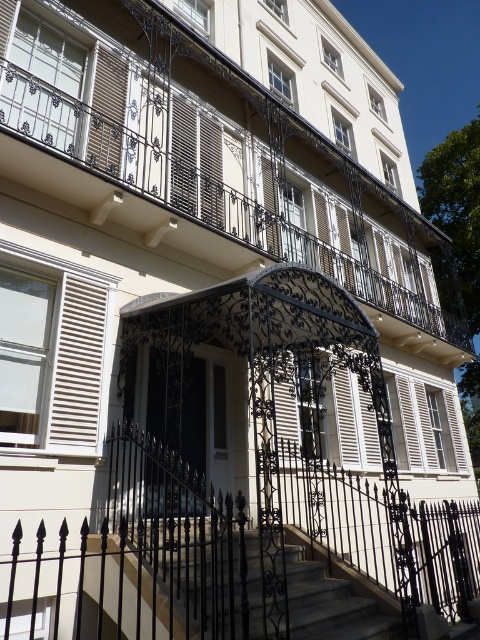
Question: Which of the following is the farthest from the observer?

Choices:
 (A) (364, 252)
 (B) (288, 545)

Answer: (A)

Question: Which is nearer to the white matte shutter at left?

Choices:
 (A) white matte shutter at upper left
 (B) smooth stone stairs at center

Answer: (A)

Question: From the image, what is the correct spatial relationship of black wrought iron balcony at center in relation to white matte shutter at left?

Choices:
 (A) above
 (B) below

Answer: (A)

Question: Which point appears closest to the camera in this image?

Choices:
 (A) coord(9,150)
 (B) coord(71,419)
 (C) coord(312,589)
 (D) coord(96,61)

Answer: (C)

Question: Does black wrought iron balcony at center have a larger size compared to white matte shutter at upper left?

Choices:
 (A) yes
 (B) no

Answer: (A)

Question: Is black wrought iron balcony at center above smooth stone stairs at center?

Choices:
 (A) no
 (B) yes

Answer: (B)